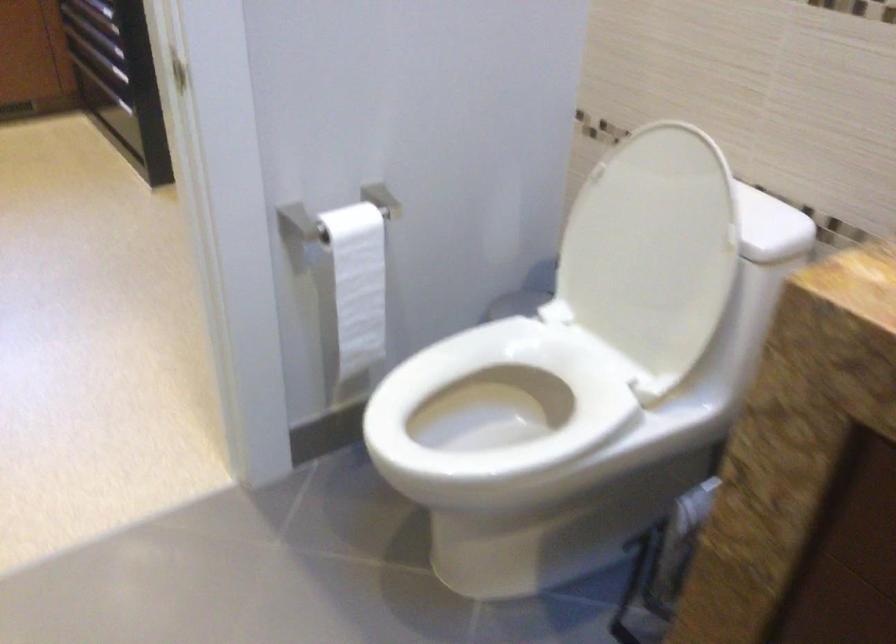
Image resolution: width=896 pixels, height=644 pixels. What do you see at coordinates (652, 251) in the screenshot?
I see `a white toilet lid` at bounding box center [652, 251].